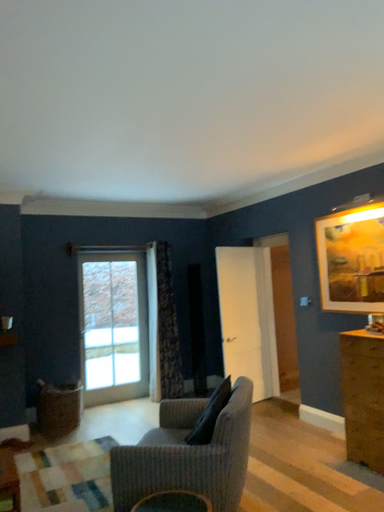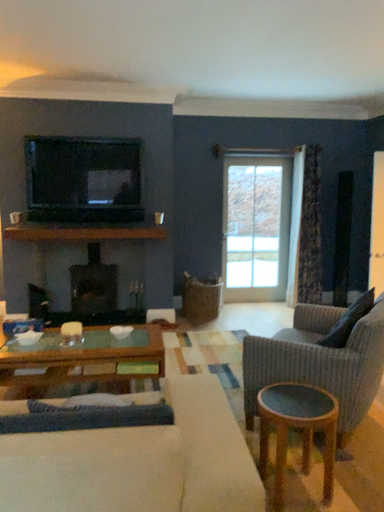
Question: How did the camera likely rotate when shooting the video?

Choices:
 (A) rotated downward
 (B) rotated upward

Answer: (A)